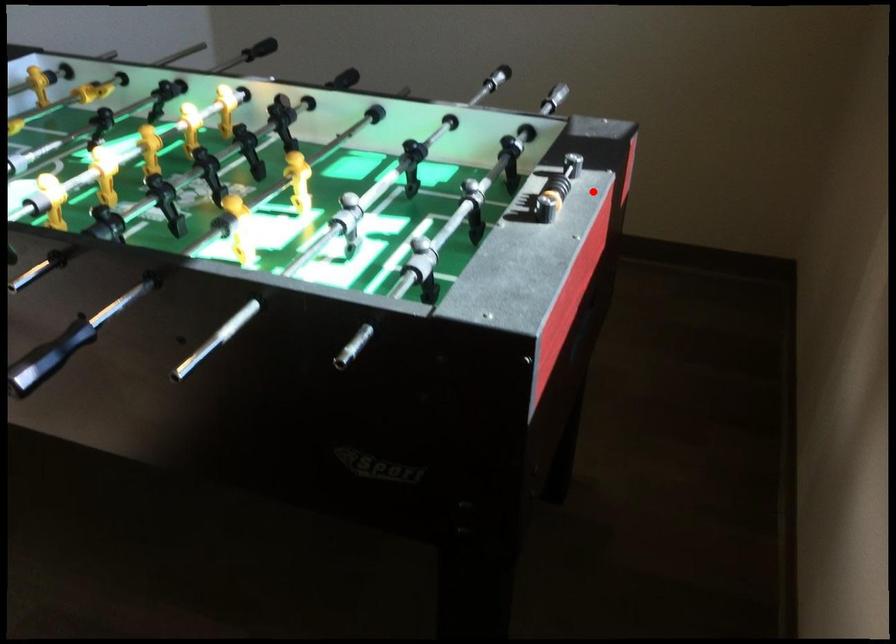
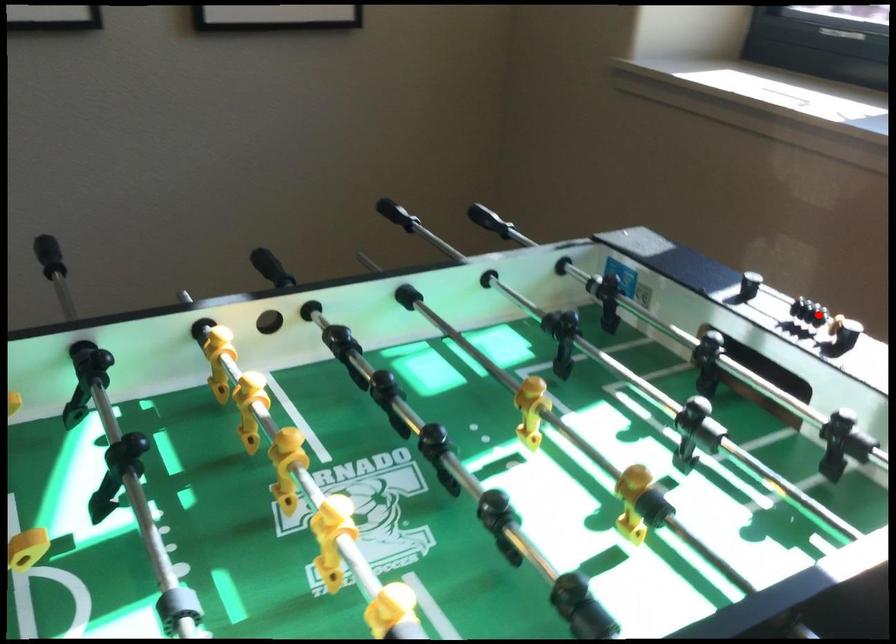
I am providing you with two images of the same scene from different viewpoints. A red point is marked on the first image and another point is marked on the second image. Do the highlighted points in image1 and image2 indicate the same real-world spot?

No